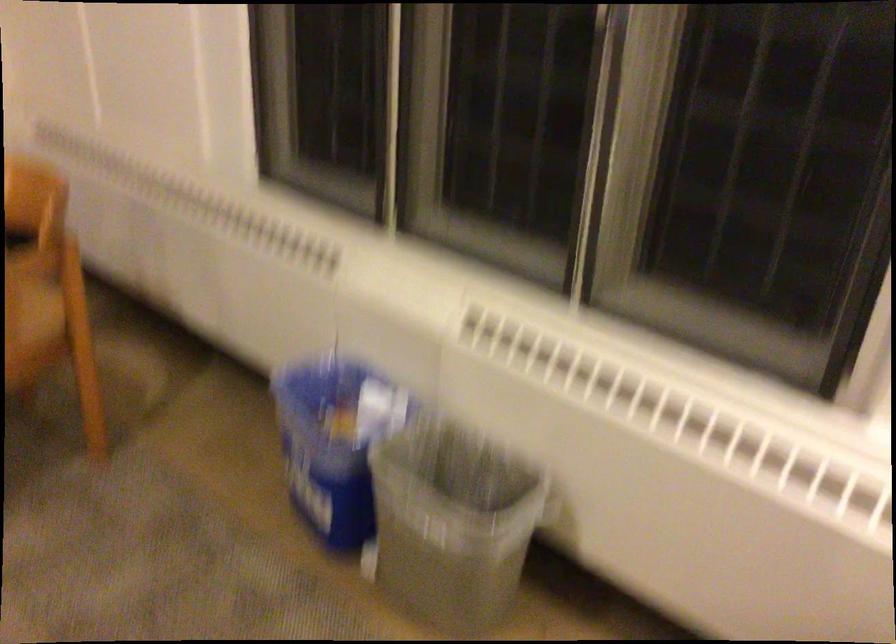
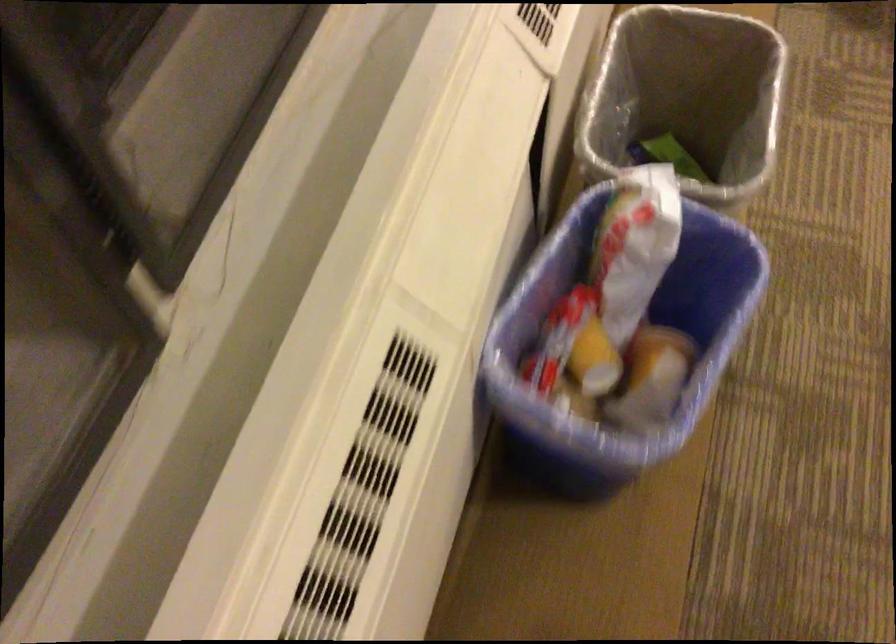
Locate, in the second image, the point that corresponds to the point at 339,456 in the first image.

(621, 343)